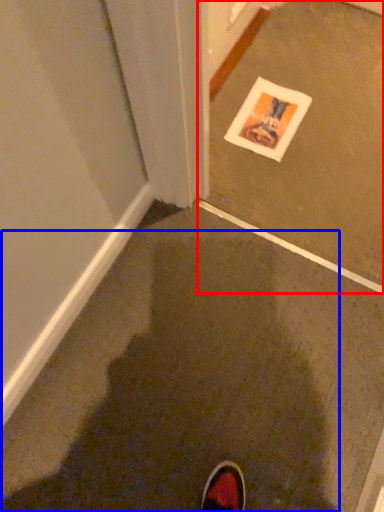
Question: Among these objects, which one is farthest to the camera, concrete (highlighted by a red box) or mud (highlighted by a blue box)?

Choices:
 (A) concrete
 (B) mud

Answer: (A)